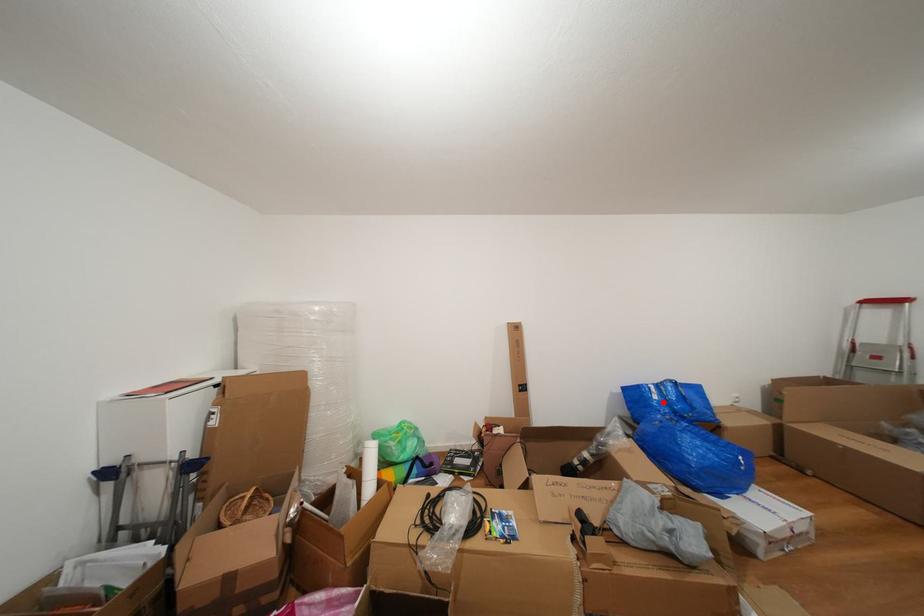
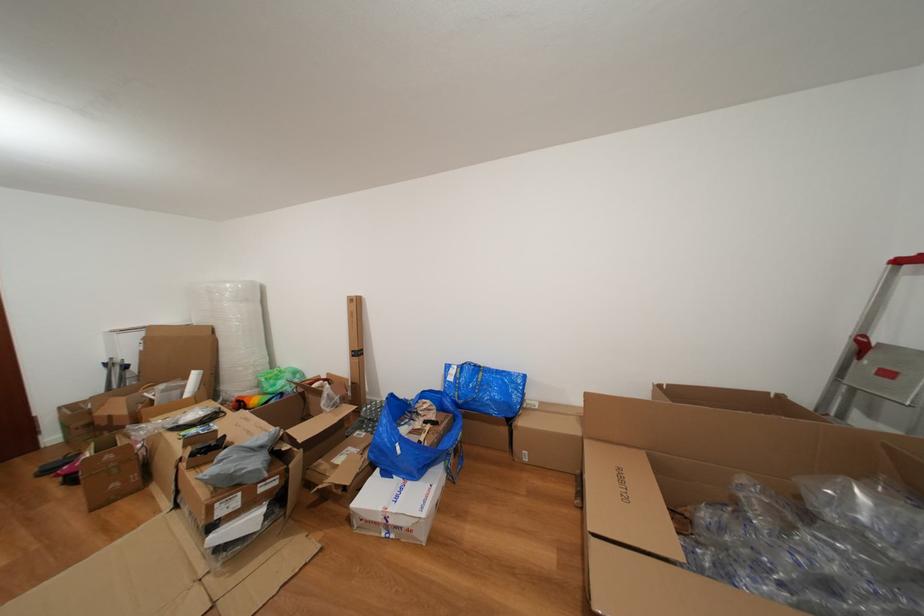
In the second image, find the point that corresponds to the highlighted location in the first image.

(458, 384)